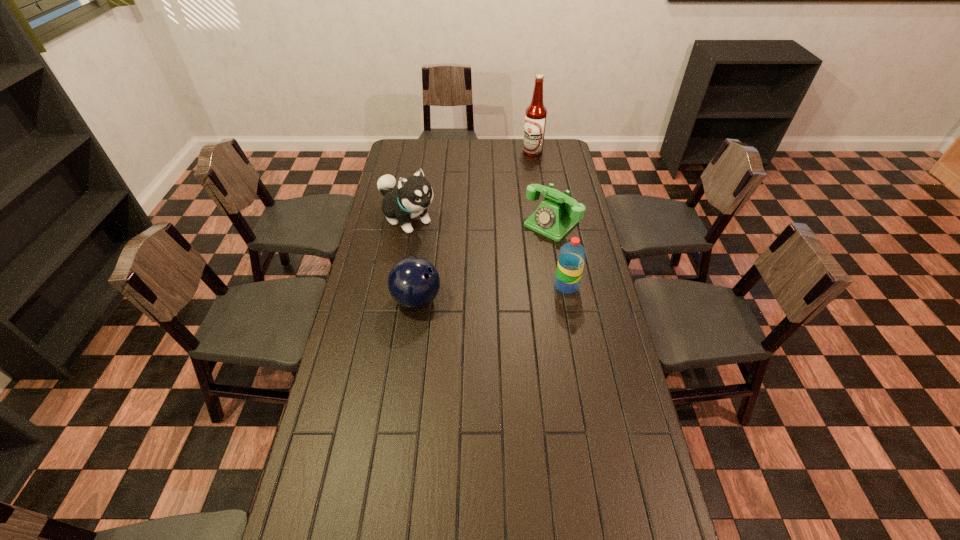
Image resolution: width=960 pixels, height=540 pixels. Identify the location of bowling ball. (414, 282).

Locate an element on the screen. the third tallest object is located at coordinates (572, 255).

You are a GUI agent. You are given a task and a screenshot of the screen. Output one action in this format:
    pyautogui.click(x=<x>, y=<y>)
    Task: Click on the tallest object
    
    Given the screenshot: What is the action you would take?
    pyautogui.click(x=536, y=113)

Locate an element on the screen. This screenshot has width=960, height=540. the farthest object is located at coordinates (536, 113).

Where is `puppy`? The width and height of the screenshot is (960, 540). puppy is located at coordinates (414, 194).

Find the location of `telephone`. telephone is located at coordinates (554, 218).

Where is `vacant area located on the surface of the bowling ball near the finger holes`? This screenshot has width=960, height=540. vacant area located on the surface of the bowling ball near the finger holes is located at coordinates click(472, 300).

I want to click on free space located on the front label of the third tallest object, so click(x=603, y=286).

Image resolution: width=960 pixels, height=540 pixels. Identify the location of blank space located on the label side of the tallest object. (519, 186).

You are a GUI agent. You are given a task and a screenshot of the screen. Output one action in this format:
    pyautogui.click(x=<x>, y=<y>)
    Task: Click on the vacant space located on the label side of the tallest object
    The height and width of the screenshot is (540, 960).
    Given the screenshot: What is the action you would take?
    pyautogui.click(x=522, y=178)